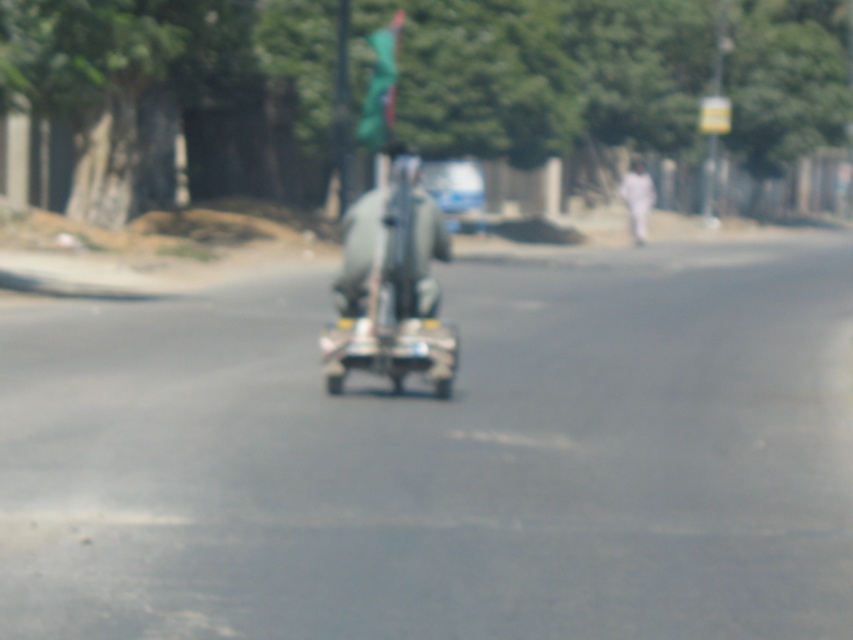
Which is below, metallic silver scooter at center or metallic silver car at center?

metallic silver scooter at center is lower down.

Is metallic silver scooter at center shorter than metallic silver car at center?

Correct, metallic silver scooter at center is not as tall as metallic silver car at center.

Measure the distance between point (403, 324) and camera.

The distance of point (403, 324) from camera is 16.58 meters.

Locate an element on the screen. The image size is (853, 640). metallic silver scooter at center is located at coordinates (390, 292).

Can you confirm if metallic silver scooter at center is shorter than metallic gray figure at center?

Incorrect, metallic silver scooter at center's height does not fall short of metallic gray figure at center's.

Is point (415, 344) positioned before point (434, 216)?

Yes, it is in front of point (434, 216).

The image size is (853, 640). Identify the location of metallic silver scooter at center. (390, 292).

Does metallic gray figure at center have a greater height compared to metallic silver car at center?

In fact, metallic gray figure at center may be shorter than metallic silver car at center.

Identify the location of metallic gray figure at center. (358, 248).